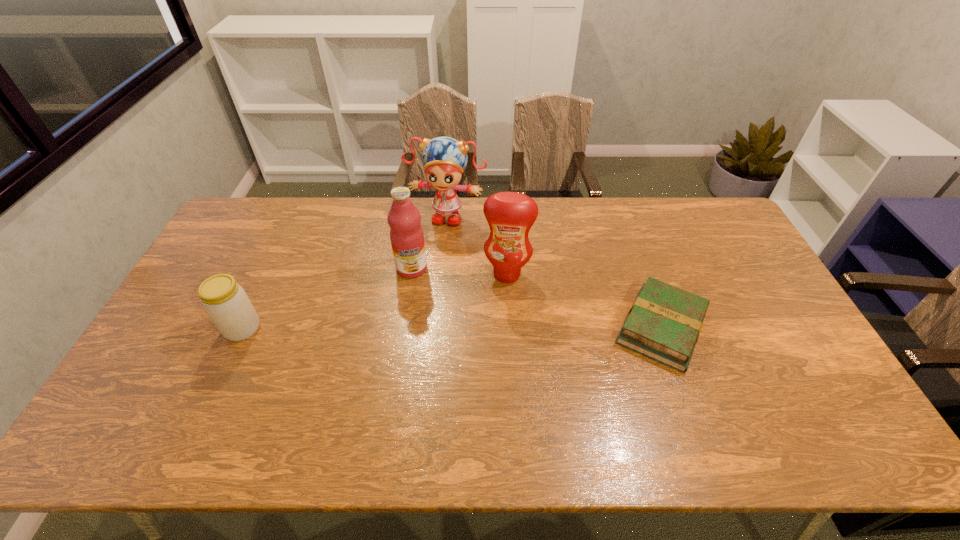
This screenshot has width=960, height=540. I want to click on vacant space located on the label of the fruit juice, so click(413, 347).

Locate an element on the screen. The image size is (960, 540). vacant region located on the label of the fruit juice is located at coordinates (413, 333).

This screenshot has width=960, height=540. What are the coordinates of `vacant space located 0.130m on the face of the doll` in the screenshot? It's located at (432, 253).

In order to click on vacant area located on the face of the doll in this screenshot , I will do `click(431, 256)`.

Identify the location of vacant space situated 0.070m on the face of the doll. (436, 241).

You are a GUI agent. You are given a task and a screenshot of the screen. Output one action in this format:
    pyautogui.click(x=<x>, y=<y>)
    Task: Click on the free region located 0.180m on the label side of the condiment
    The width and height of the screenshot is (960, 540).
    Given the screenshot: What is the action you would take?
    pyautogui.click(x=496, y=330)

The image size is (960, 540). Identify the location of vacant space located on the label side of the condiment. coord(498,317).

Where is `vacant position located on the label side of the condiment`? The width and height of the screenshot is (960, 540). vacant position located on the label side of the condiment is located at coordinates (500, 307).

Where is `object that is at the far edge`? The width and height of the screenshot is (960, 540). object that is at the far edge is located at coordinates (444, 159).

Find the location of a particular element. vacant space at the far edge is located at coordinates (314, 225).